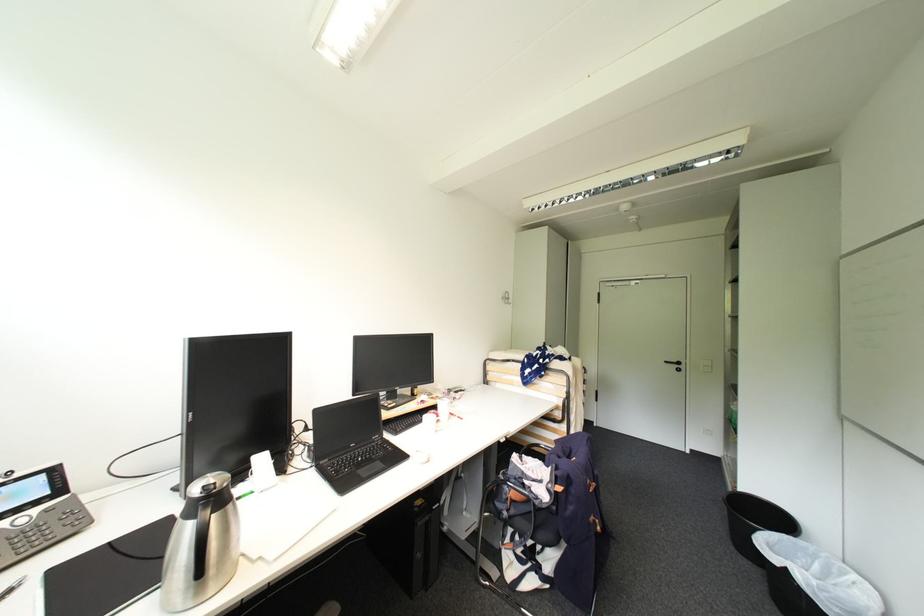
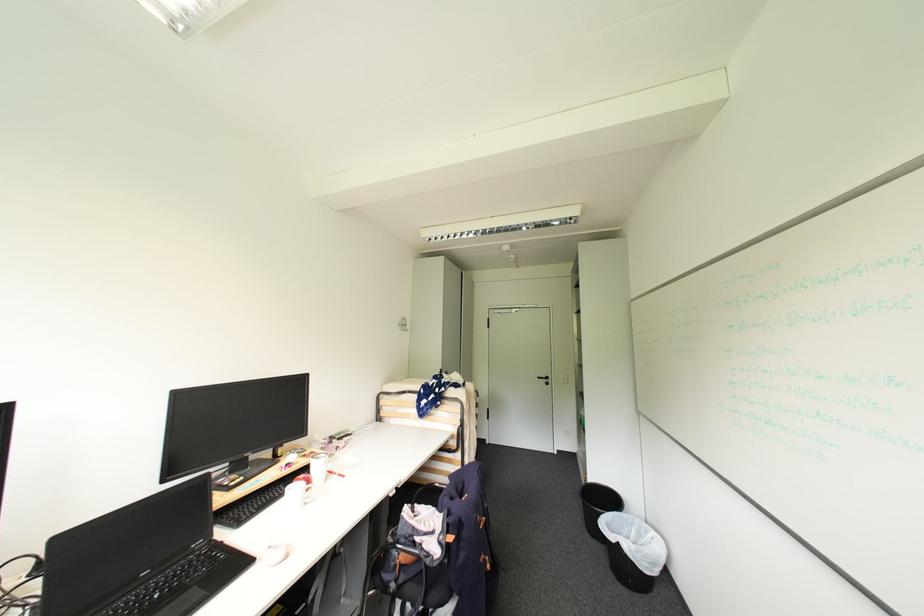
In the second image, find the point that corresponds to point 359,446 in the first image.

(150, 575)